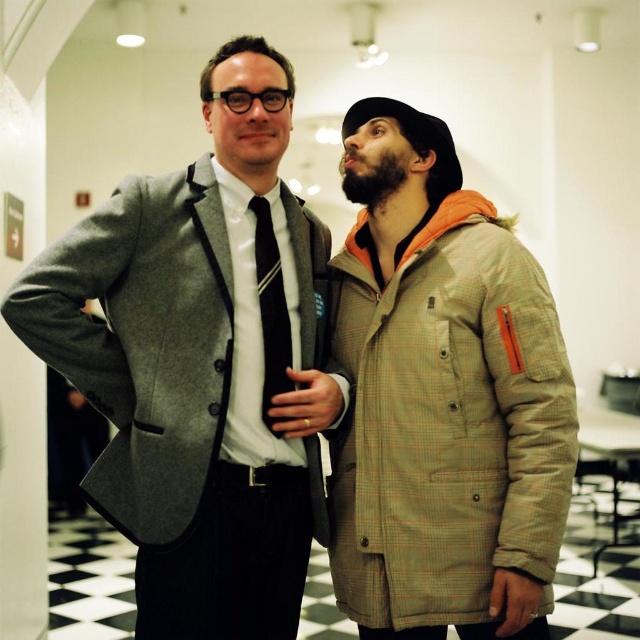
Measure the distance between plaid wool jacket at right and black silk tie at center.

A distance of 17.14 inches exists between plaid wool jacket at right and black silk tie at center.

The width and height of the screenshot is (640, 640). I want to click on plaid wool jacket at right, so click(448, 420).

Which is behind, point (496, 378) or point (269, 388)?

Point (269, 388)

Find the location of a particular element. This screenshot has width=640, height=640. plaid wool jacket at right is located at coordinates (448, 420).

Which of these two, matte gray blazer at center or black silk tie at center, stands shorter?

black silk tie at center

Can you confirm if matte gray blazer at center is shorter than black silk tie at center?

Incorrect, matte gray blazer at center's height does not fall short of black silk tie at center's.

Is point (237, 385) more distant than point (280, 369)?

No, (237, 385) is closer to viewer.

Where is `matte gray blazer at center`? matte gray blazer at center is located at coordinates (202, 364).

Does matte gray blazer at center appear on the right side of plaid wool jacket at right?

In fact, matte gray blazer at center is to the left of plaid wool jacket at right.

Looking at this image, which is more to the right, matte gray blazer at center or plaid wool jacket at right?

Positioned to the right is plaid wool jacket at right.

Is point (250, 419) farther from camera compared to point (547, 579)?

That is True.

Locate an element on the screen. This screenshot has height=640, width=640. matte gray blazer at center is located at coordinates (202, 364).